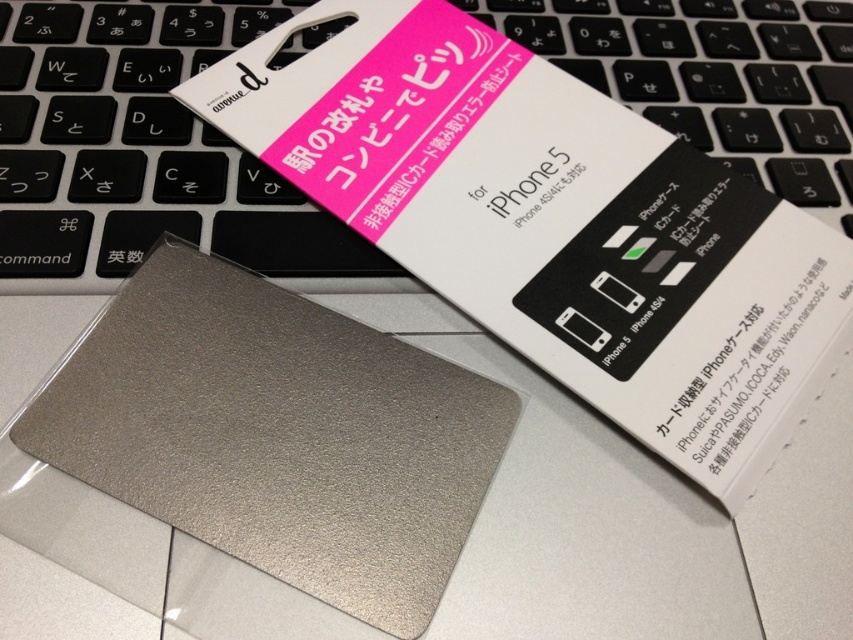
Question: Which object is closer to the camera taking this photo?

Choices:
 (A) satin silver keyboard at center
 (B) metallic silver card at center

Answer: (B)

Question: Which object appears farthest from the camera in this image?

Choices:
 (A) satin silver keyboard at center
 (B) metallic silver card at center

Answer: (A)

Question: In this image, where is metallic silver card at center located relative to satin silver keyboard at center?

Choices:
 (A) below
 (B) above

Answer: (A)

Question: Can you confirm if metallic silver card at center is bigger than satin silver keyboard at center?

Choices:
 (A) no
 (B) yes

Answer: (B)

Question: Which object appears closest to the camera in this image?

Choices:
 (A) metallic silver card at center
 (B) satin silver keyboard at center

Answer: (A)

Question: Does metallic silver card at center appear on the right side of satin silver keyboard at center?

Choices:
 (A) no
 (B) yes

Answer: (B)